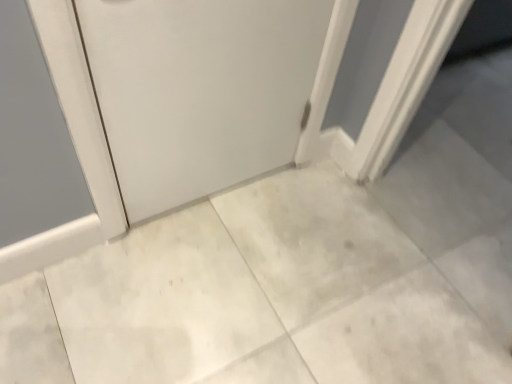
What do you see at coordinates (199, 90) in the screenshot? I see `white matte door at center` at bounding box center [199, 90].

Find the location of a particular element. The height and width of the screenshot is (384, 512). white matte door at center is located at coordinates (199, 90).

Locate an element on the screen. The image size is (512, 384). white matte door at center is located at coordinates (199, 90).